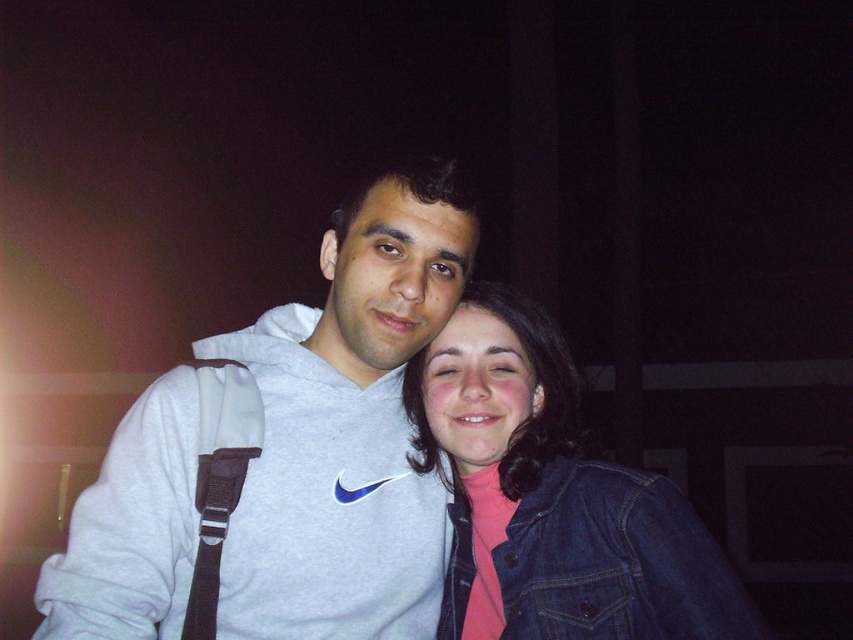
Does point (496, 512) lie in front of point (576, 522)?

No, (496, 512) is further to viewer.

Does point (463, 595) lie behind point (495, 547)?

Yes, it is behind point (495, 547).

What are the coordinates of `gray sweatshirt at center` in the screenshot? It's located at (467, 481).